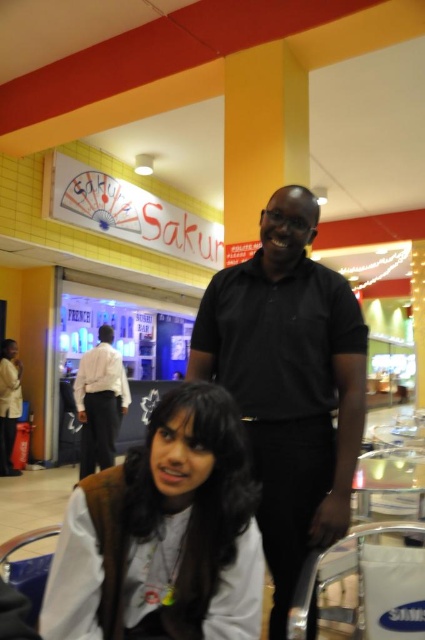
You are trying to decide which person to approach for assistance in the food court. The black matte shirt at center and the white shirt at lower left are both facing you. Based on their sizes, which one might be easier to spot from a distance?

The black matte shirt at center is larger in size than the white shirt at lower left, so it would be easier to spot from a distance.

You are a photographer setting up for a group photo in the food court. You notice two people wearing the black matte shirt at center and the white shirt at lower left. Which person should you position closer to the camera to ensure their face is clearly visible in the photo?

The black matte shirt at center has a lesser height compared to white shirt at lower left, so you should position the black matte shirt at center closer to the camera to ensure their face is clearly visible in the photo.